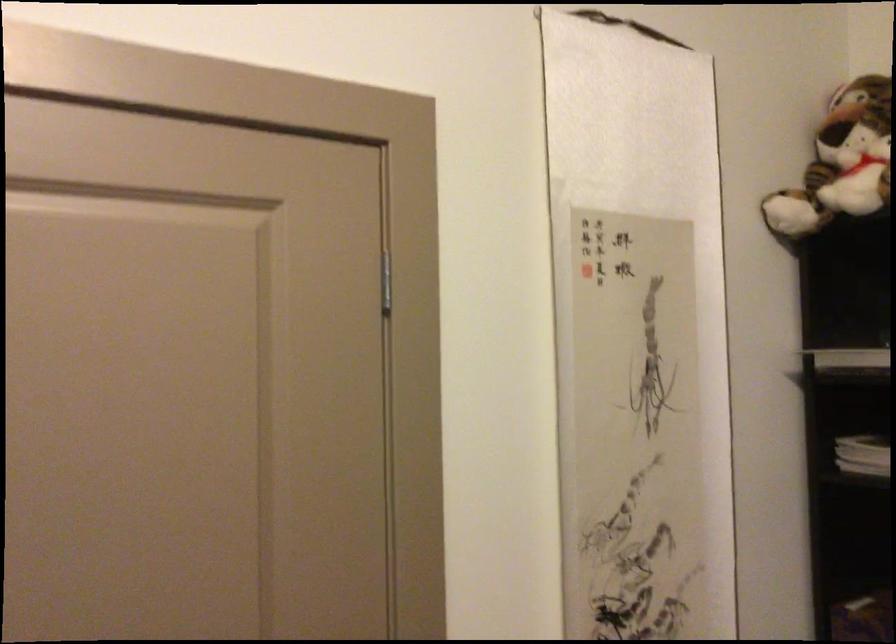
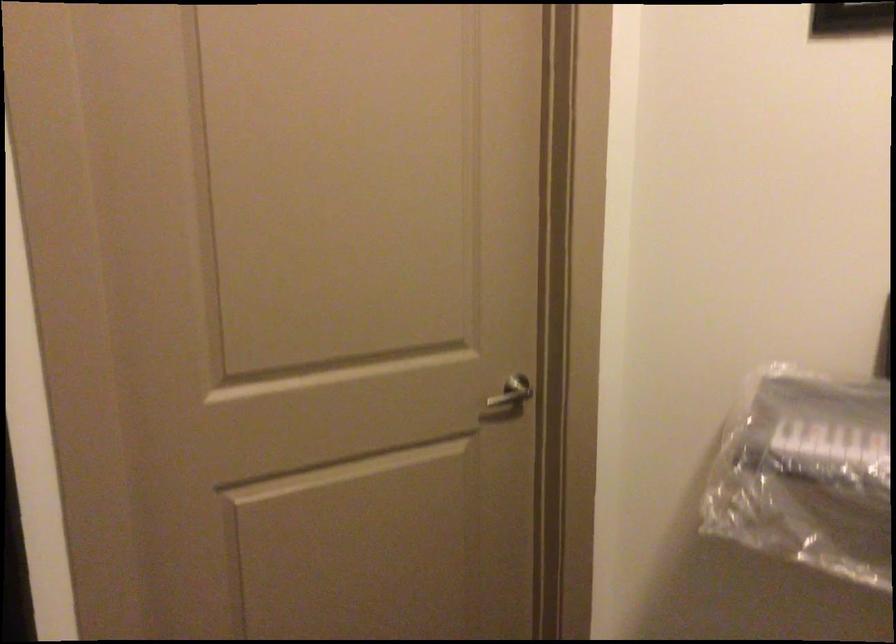
Question: The images are taken continuously from a first-person perspective. In which direction is your viewpoint rotating?

Choices:
 (A) Left
 (B) Right
 (C) Up
 (D) Down

Answer: (B)